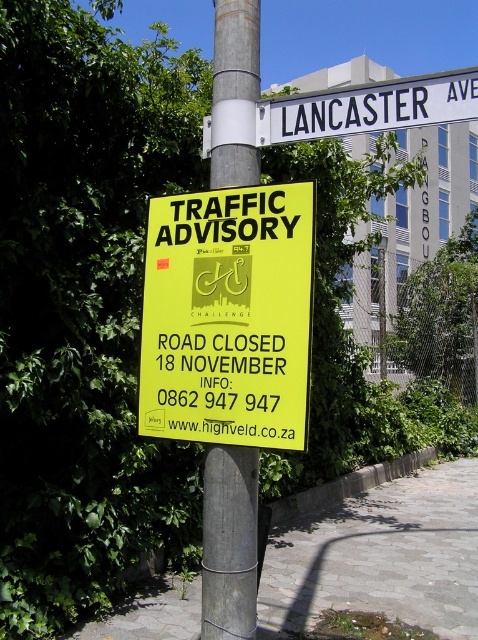
Question: Which is nearer to the gray concrete pavement at lower center?

Choices:
 (A) silver metallic pole at center
 (B) white plastic street sign at upper center

Answer: (A)

Question: Can you confirm if yellow paper sign at center is smaller than white plastic street sign at upper center?

Choices:
 (A) yes
 (B) no

Answer: (B)

Question: Which of the following is the farthest from the observer?

Choices:
 (A) silver metallic pole at center
 (B) white plastic street sign at upper center
 (C) yellow paper sign at center
 (D) gray concrete pavement at lower center

Answer: (D)

Question: Observing the image, what is the correct spatial positioning of yellow paper sign at center in reference to white plastic street sign at upper center?

Choices:
 (A) right
 (B) left

Answer: (B)

Question: Where is yellow paper sign at center located in relation to gray concrete pavement at lower center in the image?

Choices:
 (A) left
 (B) right

Answer: (A)

Question: Which point is closer to the camera?

Choices:
 (A) gray concrete pavement at lower center
 (B) yellow paper sign at center
 (C) silver metallic pole at center
 (D) white plastic street sign at upper center

Answer: (D)